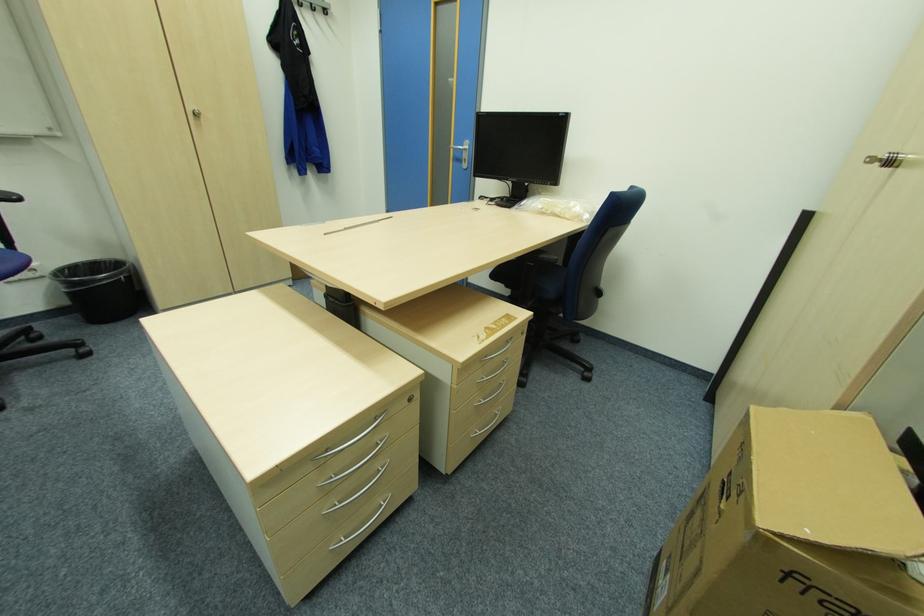
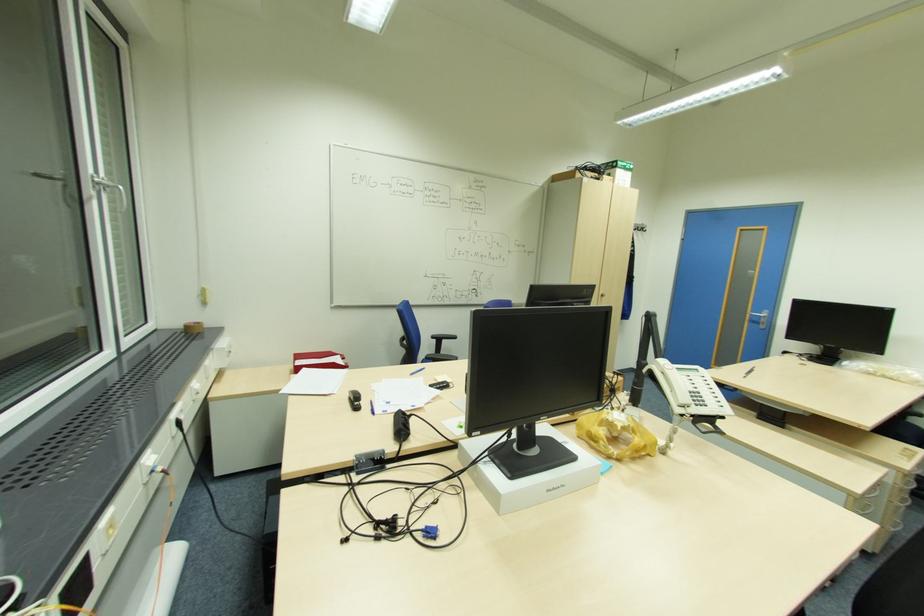
Where in the second image is the point corresponding to (201,115) from the first image?

(604, 294)